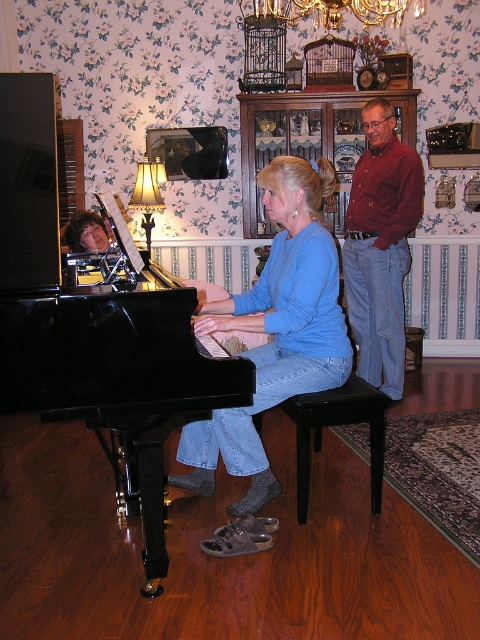
Question: Based on their relative distances, which object is farther from the black glossy piano at left?

Choices:
 (A) blue cotton shirt at center
 (B) black wood stool at center

Answer: (B)

Question: Which object is farther from the camera taking this photo?

Choices:
 (A) black glossy piano at left
 (B) black wood stool at center

Answer: (B)

Question: Can you confirm if red shirt at right is positioned above black wood stool at center?

Choices:
 (A) yes
 (B) no

Answer: (A)

Question: Based on their relative distances, which object is farther from the black wood stool at center?

Choices:
 (A) gold crystal chandelier at upper center
 (B) blue cotton shirt at center
 (C) red shirt at right

Answer: (A)

Question: Where is blue cotton shirt at center located in relation to gold crystal chandelier at upper center in the image?

Choices:
 (A) below
 (B) above

Answer: (A)

Question: Does red shirt at right have a larger size compared to gold crystal chandelier at upper center?

Choices:
 (A) no
 (B) yes

Answer: (A)